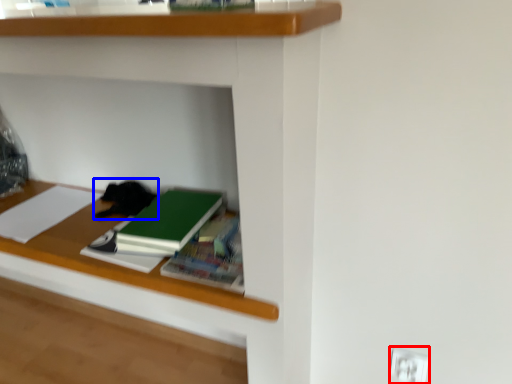
Question: Which object is closer to the camera taking this photo, electric outlet (highlighted by a red box) or cat (highlighted by a blue box)?

Choices:
 (A) electric outlet
 (B) cat

Answer: (A)